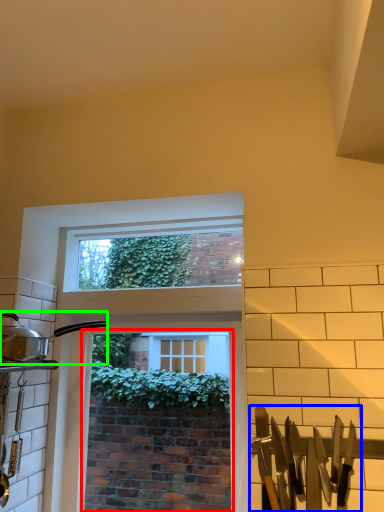
Question: Based on their relative distances, which object is farther from window screen (highlighted by a red box)? Choose from silverware (highlighted by a blue box) and kitchen appliance (highlighted by a green box).

Choices:
 (A) silverware
 (B) kitchen appliance

Answer: (A)